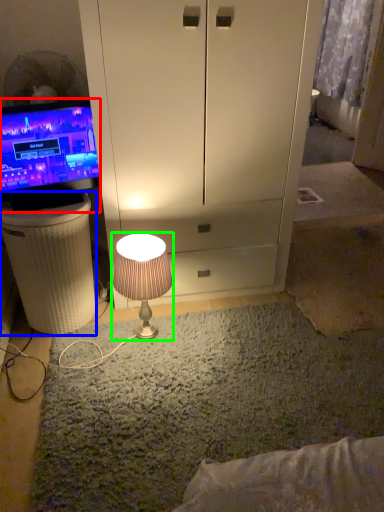
Question: Which is nearer to the television (highlighted by a red box)? vanity (highlighted by a blue box) or lamp (highlighted by a green box).

Choices:
 (A) vanity
 (B) lamp

Answer: (A)